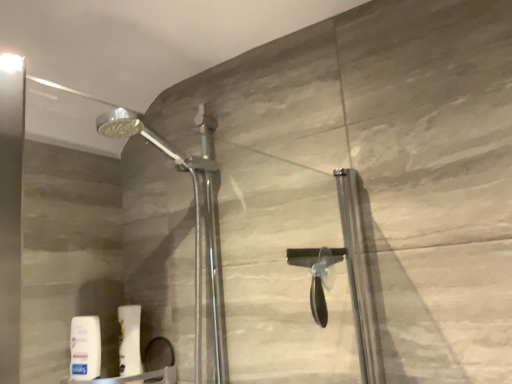
Question: Is white matte lotion at lower left, arranged as the first toiletry when viewed from the left, to the right of transparent glass door at center from the viewer's perspective?

Choices:
 (A) yes
 (B) no

Answer: (B)

Question: Is white matte lotion at lower left, which is the second toiletry in right-to-left order, further to camera compared to transparent glass door at center?

Choices:
 (A) no
 (B) yes

Answer: (B)

Question: Is white matte lotion at lower left, which is the second toiletry in right-to-left order, smaller than transparent glass door at center?

Choices:
 (A) no
 (B) yes

Answer: (B)

Question: From the image's perspective, is white matte lotion at lower left, which is the second toiletry in right-to-left order, on top of transparent glass door at center?

Choices:
 (A) no
 (B) yes

Answer: (A)

Question: Is white matte lotion at lower left, which is the second toiletry in right-to-left order, to the left of transparent glass door at center from the viewer's perspective?

Choices:
 (A) no
 (B) yes

Answer: (B)

Question: Considering the positions of white matte lotion at lower left, arranged as the first toiletry when viewed from the left, and transparent glass door at center in the image, is white matte lotion at lower left, arranged as the first toiletry when viewed from the left, taller or shorter than transparent glass door at center?

Choices:
 (A) tall
 (B) short

Answer: (B)

Question: Would you say white matte lotion at lower left, arranged as the first toiletry when viewed from the left, is inside or outside transparent glass door at center?

Choices:
 (A) outside
 (B) inside

Answer: (A)

Question: Considering the positions of white matte lotion at lower left, which is the second toiletry in right-to-left order, and transparent glass door at center in the image, is white matte lotion at lower left, which is the second toiletry in right-to-left order, wider or thinner than transparent glass door at center?

Choices:
 (A) wide
 (B) thin

Answer: (B)

Question: From a real-world perspective, is white matte lotion at lower left, arranged as the first toiletry when viewed from the left, positioned above or below transparent glass door at center?

Choices:
 (A) below
 (B) above

Answer: (A)

Question: From a real-world perspective, is white matte tube at lower left, the second toiletry in the left-to-right sequence, positioned above or below transparent glass door at center?

Choices:
 (A) below
 (B) above

Answer: (A)

Question: From the image's perspective, is white matte tube at lower left, the first toiletry positioned from the right, above or below transparent glass door at center?

Choices:
 (A) below
 (B) above

Answer: (A)

Question: Is white matte tube at lower left, the first toiletry positioned from the right, wider or thinner than transparent glass door at center?

Choices:
 (A) wide
 (B) thin

Answer: (B)

Question: Relative to transparent glass door at center, is white matte tube at lower left, the second toiletry in the left-to-right sequence, in front or behind?

Choices:
 (A) behind
 (B) front

Answer: (A)

Question: In terms of size, does white matte lotion at lower left, arranged as the first toiletry when viewed from the left, appear bigger or smaller than white matte tube at lower left, the first toiletry positioned from the right?

Choices:
 (A) big
 (B) small

Answer: (A)

Question: Is white matte lotion at lower left, which is the second toiletry in right-to-left order, to the left or to the right of white matte tube at lower left, the second toiletry in the left-to-right sequence, in the image?

Choices:
 (A) left
 (B) right

Answer: (A)